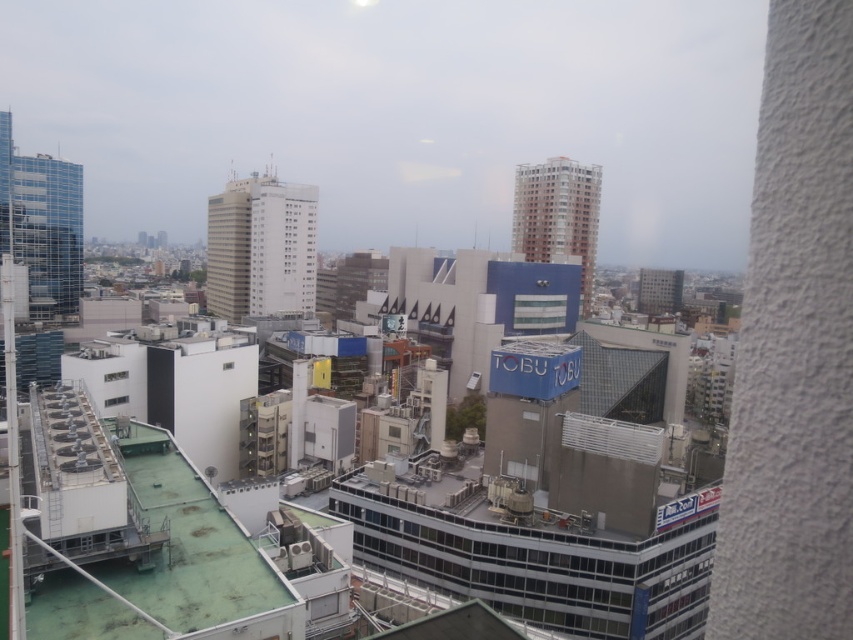
Question: Which point appears farthest from the camera in this image?

Choices:
 (A) (119, 376)
 (B) (119, 401)

Answer: (A)

Question: Is the position of white plastic window at lower left less distant than that of transparent glass window at center?

Choices:
 (A) no
 (B) yes

Answer: (B)

Question: Which point is closer to the camera?

Choices:
 (A) [107, 403]
 (B) [115, 374]

Answer: (A)

Question: Can you confirm if white plastic window at lower left is thinner than transparent glass window at center?

Choices:
 (A) no
 (B) yes

Answer: (B)

Question: Does white plastic window at lower left appear on the right side of transparent glass window at center?

Choices:
 (A) no
 (B) yes

Answer: (A)